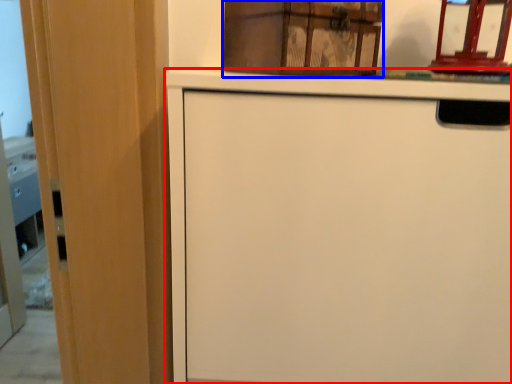
Question: Which object is further to the camera taking this photo, cabinetry (highlighted by a red box) or cabinetry (highlighted by a blue box)?

Choices:
 (A) cabinetry
 (B) cabinetry

Answer: (B)